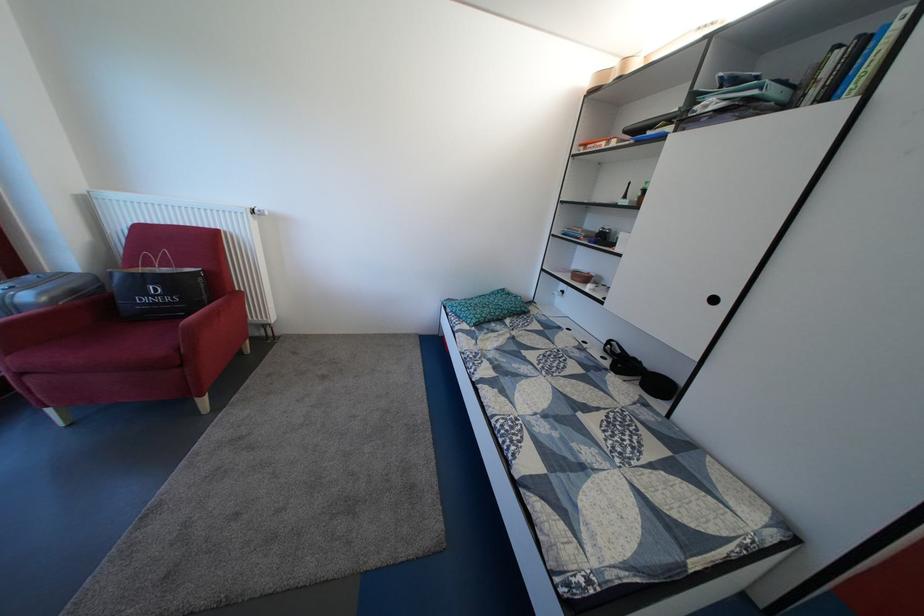
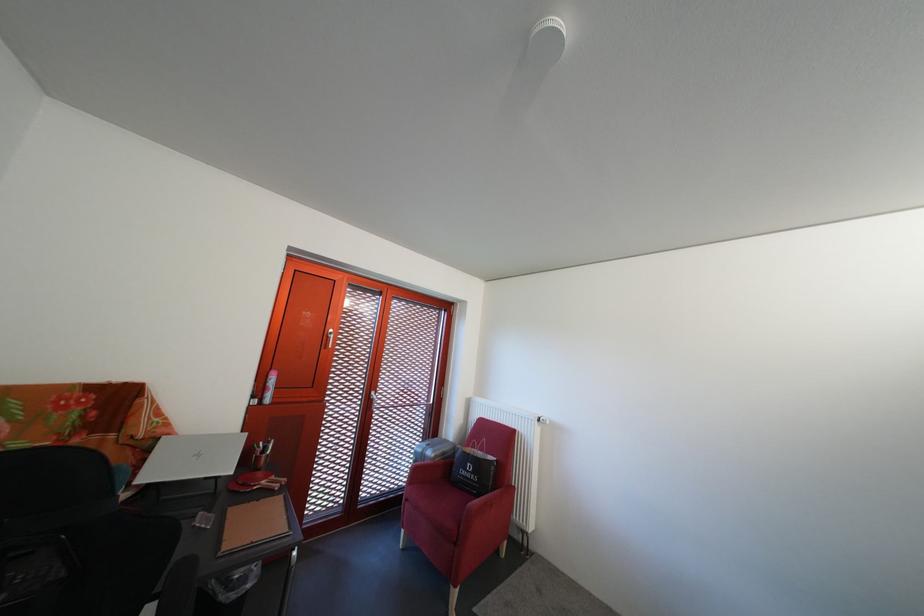
Based on the continuous images, in which direction is the camera rotating?

The camera rotated toward left-up.